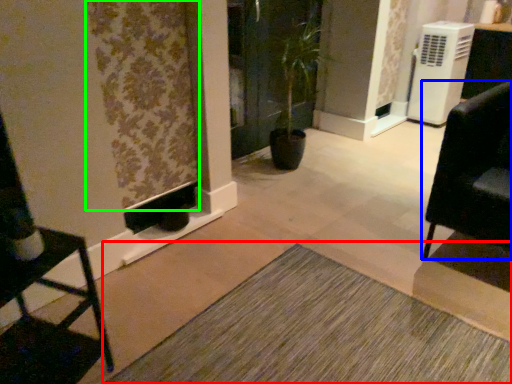
Question: Which object is positioned farthest from doormat (highlighted by a red box)? Select from furniture (highlighted by a blue box) and curtain (highlighted by a green box).

Choices:
 (A) furniture
 (B) curtain

Answer: (B)